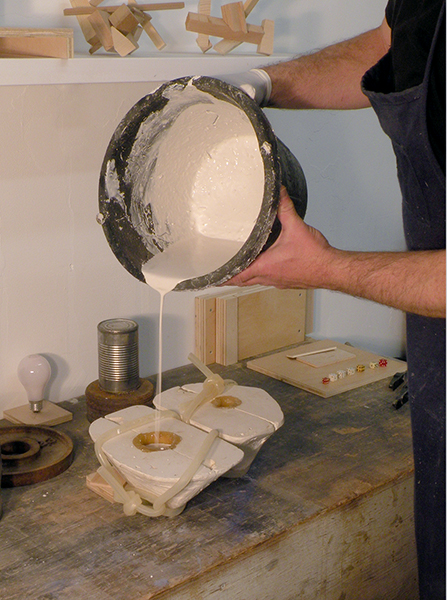
Find the location of a particular element. The width and height of the screenshot is (447, 600). wooden board is located at coordinates (301, 374).